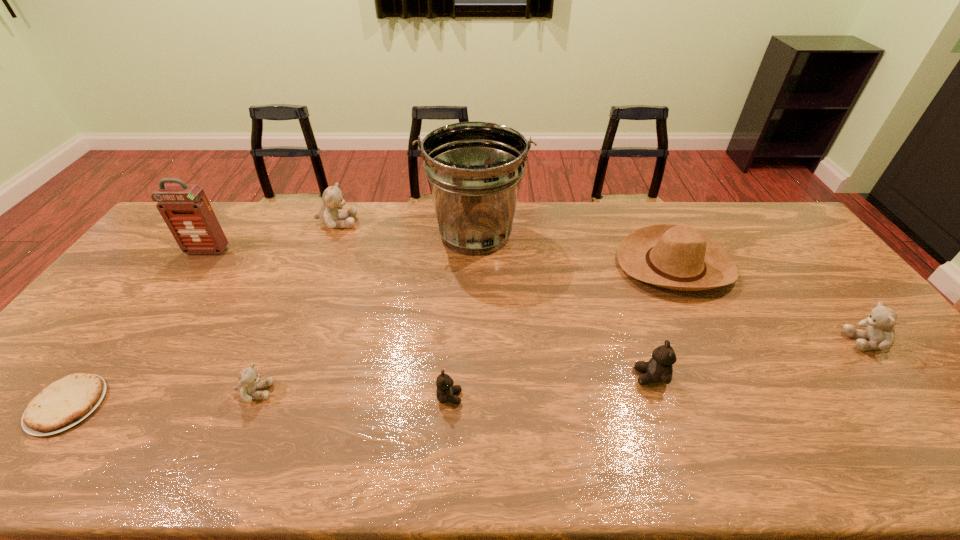
In order to click on cowboy hat that is at the far edge in this screenshot , I will do `click(678, 257)`.

Locate an element on the screen. object situated at the near edge is located at coordinates (64, 403).

Where is `the first-aid kit that is at the left edge`? the first-aid kit that is at the left edge is located at coordinates (185, 208).

Where is `tortilla that is positioned at the left edge`? The height and width of the screenshot is (540, 960). tortilla that is positioned at the left edge is located at coordinates (64, 403).

Where is `object located in the right edge section of the desktop`? Image resolution: width=960 pixels, height=540 pixels. object located in the right edge section of the desktop is located at coordinates (880, 332).

Locate an element on the screen. This screenshot has width=960, height=540. object positioned at the near left corner is located at coordinates (64, 403).

You are a GUI agent. You are given a task and a screenshot of the screen. Output one action in this format:
    pyautogui.click(x=<x>, y=<y>)
    Task: Click on the vacant region at the far edge of the desktop
    This screenshot has width=960, height=540.
    Given the screenshot: What is the action you would take?
    pyautogui.click(x=550, y=234)

The image size is (960, 540). I want to click on vacant area at the near edge, so (x=735, y=463).

The height and width of the screenshot is (540, 960). I want to click on vacant space at the left edge of the desktop, so (x=102, y=305).

Locate an element on the screen. The image size is (960, 540). unoccupied area between the biggest gray teddy bear and the bucket is located at coordinates (406, 228).